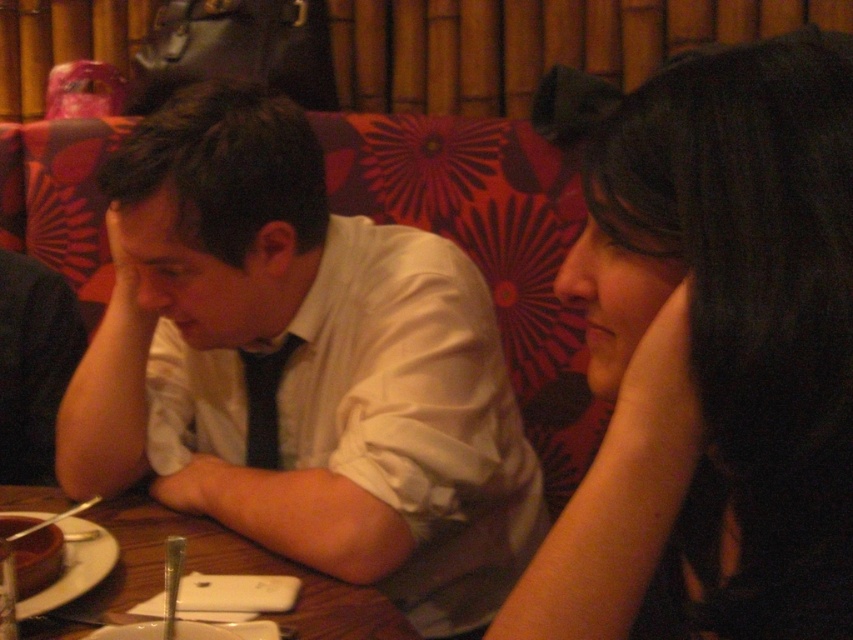
Question: Among these objects, which one is farthest from the camera?

Choices:
 (A) chocolate cake at lower left
 (B) black hair at upper right

Answer: (A)

Question: Can you confirm if black hair at upper right is smaller than chocolate cake at lower left?

Choices:
 (A) yes
 (B) no

Answer: (B)

Question: Among these objects, which one is farthest from the camera?

Choices:
 (A) black hair at upper right
 (B) wooden table at center
 (C) white satin shirt at center
 (D) chocolate cake at lower left

Answer: (C)

Question: Is white satin shirt at center positioned at the back of chocolate cake at lower left?

Choices:
 (A) no
 (B) yes

Answer: (B)

Question: Is white satin shirt at center positioned in front of wooden table at center?

Choices:
 (A) yes
 (B) no

Answer: (B)

Question: Which object is farther from the camera taking this photo?

Choices:
 (A) black hair at upper right
 (B) white satin shirt at center
 (C) chocolate cake at lower left

Answer: (B)